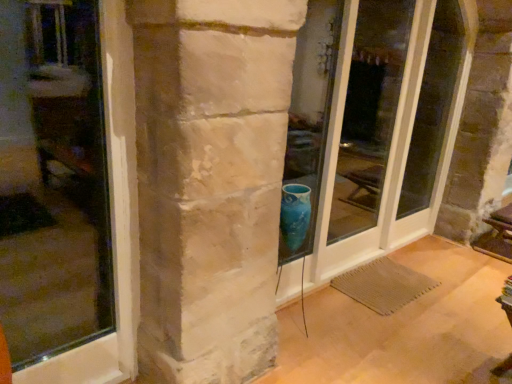
This screenshot has width=512, height=384. What are the coordinates of `free space in front of white glossy door at center` in the screenshot? It's located at (366, 303).